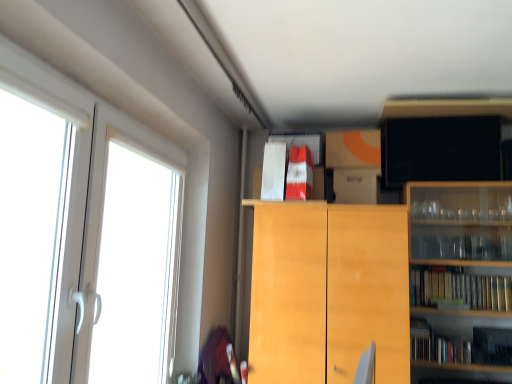
Question: Does black matte tv at upper right, positioned as the 4th cabinetry in bottom-to-top order, have a greater height compared to light wood cabinet at center, which appears as the 4th cabinetry when viewed from the top?

Choices:
 (A) no
 (B) yes

Answer: (A)

Question: Could you tell me if black matte tv at upper right, marked as the 1th cabinetry in a top-to-bottom arrangement, is turned towards light wood cabinet at center, which appears as the 4th cabinetry when viewed from the top?

Choices:
 (A) yes
 (B) no

Answer: (B)

Question: Is black matte tv at upper right, marked as the 1th cabinetry in a top-to-bottom arrangement, oriented away from light wood cabinet at center, the 1th cabinetry positioned from the bottom?

Choices:
 (A) no
 (B) yes

Answer: (A)

Question: Is black matte tv at upper right, marked as the 1th cabinetry in a top-to-bottom arrangement, positioned far away from light wood cabinet at center, the 1th cabinetry positioned from the bottom?

Choices:
 (A) no
 (B) yes

Answer: (A)

Question: Is black matte tv at upper right, positioned as the 4th cabinetry in bottom-to-top order, behind light wood cabinet at center, which appears as the 4th cabinetry when viewed from the top?

Choices:
 (A) no
 (B) yes

Answer: (B)

Question: Considering their positions, is white plastic screen door at left located in front of or behind black matte tv at upper right, positioned as the 4th cabinetry in bottom-to-top order?

Choices:
 (A) behind
 (B) front

Answer: (B)

Question: Is white plastic screen door at left wider or thinner than black matte tv at upper right, marked as the 1th cabinetry in a top-to-bottom arrangement?

Choices:
 (A) wide
 (B) thin

Answer: (A)

Question: In the image, is white plastic screen door at left on the left side or the right side of black matte tv at upper right, marked as the 1th cabinetry in a top-to-bottom arrangement?

Choices:
 (A) left
 (B) right

Answer: (A)

Question: From a real-world perspective, is white plastic screen door at left positioned above or below black matte tv at upper right, positioned as the 4th cabinetry in bottom-to-top order?

Choices:
 (A) above
 (B) below

Answer: (B)

Question: Does point (297, 165) appear closer or farther from the camera than point (390, 134)?

Choices:
 (A) farther
 (B) closer

Answer: (B)

Question: From the image's perspective, is red glossy book at upper center, placed as the 3th book when sorted from bottom to top, positioned above or below black matte tv at upper right, marked as the 1th cabinetry in a top-to-bottom arrangement?

Choices:
 (A) below
 (B) above

Answer: (A)

Question: In terms of size, does red glossy book at upper center, the second book viewed from the right, appear bigger or smaller than black matte tv at upper right, positioned as the 4th cabinetry in bottom-to-top order?

Choices:
 (A) big
 (B) small

Answer: (A)

Question: Considering the positions of red glossy book at upper center, arranged as the second book when viewed from the left, and black matte tv at upper right, marked as the 1th cabinetry in a top-to-bottom arrangement, in the image, is red glossy book at upper center, arranged as the second book when viewed from the left, wider or thinner than black matte tv at upper right, marked as the 1th cabinetry in a top-to-bottom arrangement,?

Choices:
 (A) thin
 (B) wide

Answer: (B)

Question: Does point (316, 211) appear closer or farther from the camera than point (120, 301)?

Choices:
 (A) farther
 (B) closer

Answer: (B)

Question: Is light wood cabinet at center, which appears as the 4th cabinetry when viewed from the top, taller or shorter than white plastic screen door at left?

Choices:
 (A) short
 (B) tall

Answer: (A)